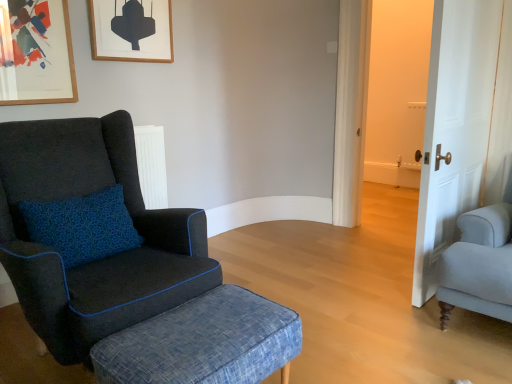
Locate an element on the screen. empty space that is ontop of denim textured stool at lower left (from a real-world perspective) is located at coordinates (198, 326).